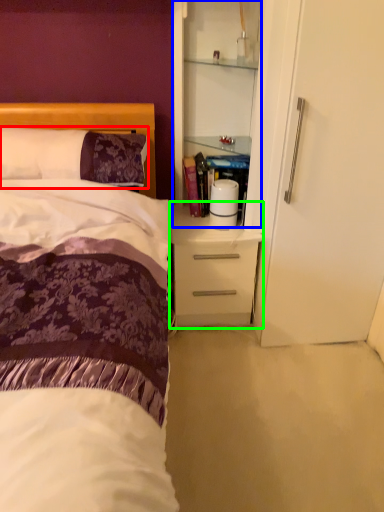
Question: Which object is the closest to the pillow (highlighted by a red box)? Choose among these: cabinetry (highlighted by a blue box) or desk (highlighted by a green box).

Choices:
 (A) cabinetry
 (B) desk

Answer: (A)